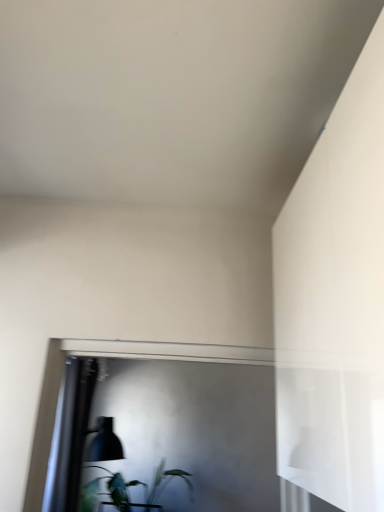
Question: From a real-world perspective, is matte black lampshade at lower left physically located above or below green leafy plant at lower left?

Choices:
 (A) above
 (B) below

Answer: (A)

Question: Based on their positions, is matte black lampshade at lower left located to the left or right of green leafy plant at lower left?

Choices:
 (A) right
 (B) left

Answer: (B)

Question: From their relative heights in the image, would you say matte black lampshade at lower left is taller or shorter than green leafy plant at lower left?

Choices:
 (A) short
 (B) tall

Answer: (B)

Question: In terms of height, does green leafy plant at lower left look taller or shorter compared to matte black lampshade at lower left?

Choices:
 (A) short
 (B) tall

Answer: (A)

Question: From a real-world perspective, is green leafy plant at lower left positioned above or below matte black lampshade at lower left?

Choices:
 (A) below
 (B) above

Answer: (A)

Question: Is point (158, 507) positioned closer to the camera than point (120, 456)?

Choices:
 (A) farther
 (B) closer

Answer: (B)

Question: Would you say green leafy plant at lower left is to the left or to the right of matte black lampshade at lower left in the picture?

Choices:
 (A) left
 (B) right

Answer: (B)